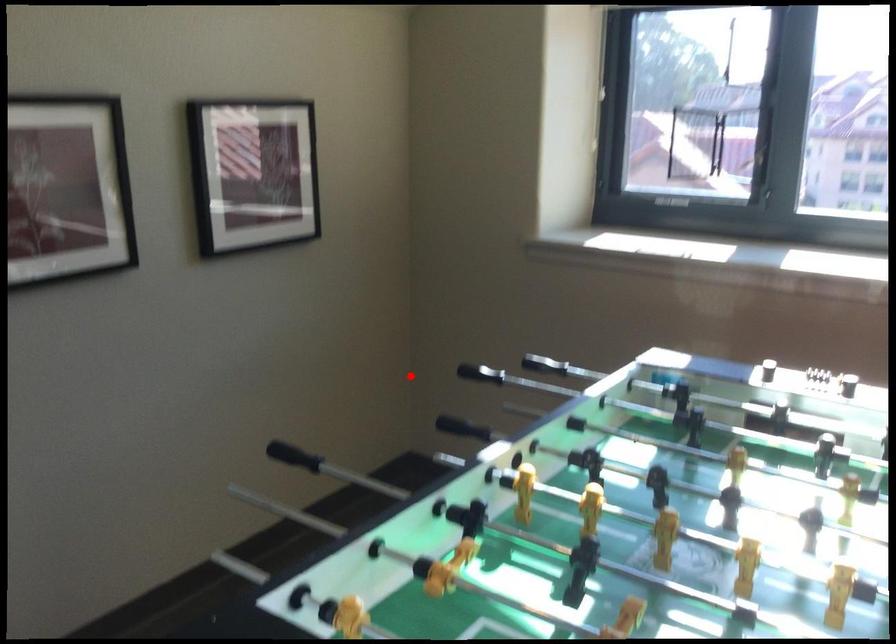
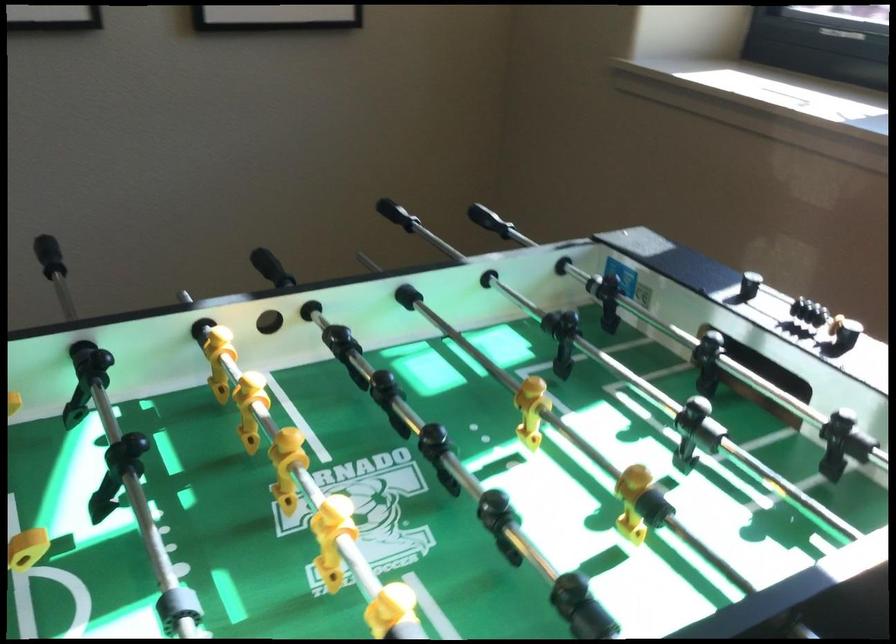
Question: I am providing you with two images of the same scene from different viewpoints. Given a red point in image1, look at the same physical point in image2. Is it:

Choices:
 (A) Closer to the viewpoint
 (B) Farther from the viewpoint

Answer: (A)